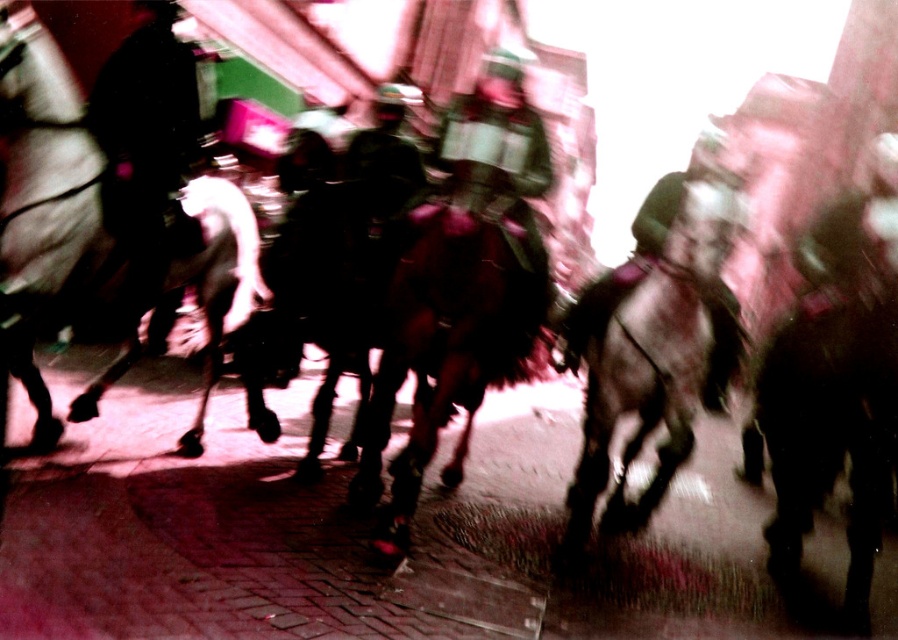
Question: Is the position of white glossy horse at left less distant than that of dark brown fur at right?

Choices:
 (A) no
 (B) yes

Answer: (B)

Question: Can you confirm if dark brown fur at right is wider than dark brown fur horse at center?

Choices:
 (A) yes
 (B) no

Answer: (B)

Question: Observing the image, what is the correct spatial positioning of white glossy horse at left in reference to dark brown fur at right?

Choices:
 (A) right
 (B) left

Answer: (B)

Question: Which of the following is the farthest from the observer?

Choices:
 (A) white glossy horse at left
 (B) dark brown fur horse at center
 (C) shiny brown horse at center
 (D) dark brown fur at right

Answer: (D)

Question: Which point is closer to the camera?

Choices:
 (A) (719, 196)
 (B) (531, 276)
 (C) (218, 208)
 (D) (784, 376)

Answer: (A)

Question: Which object is positioned closest to the shiny brown horse at center?

Choices:
 (A) white glossy horse at left
 (B) dark brown fur horse at center
 (C) dark brown fur at right

Answer: (B)